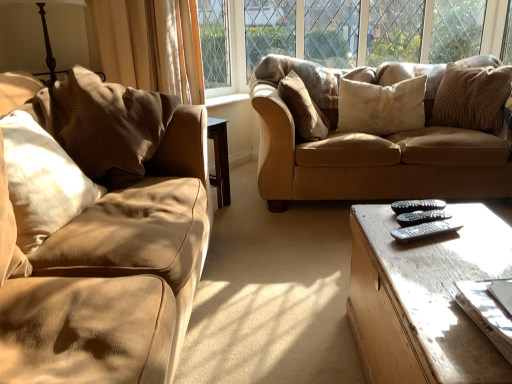
Locate an element on the screen. Image resolution: width=512 pixels, height=384 pixels. free space in front of black plastic remote at center, arranged as the first remote when viewed from the back is located at coordinates (453, 236).